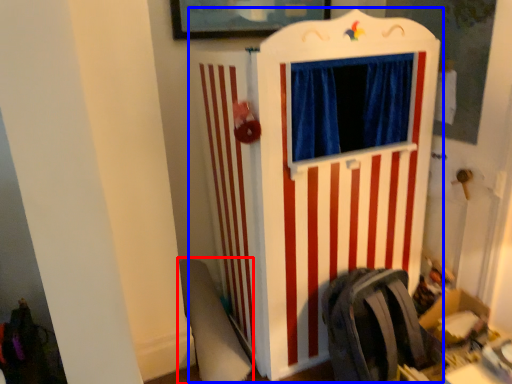
Question: Which object is closer to the camera taking this photo, swivel chair (highlighted by a red box) or furniture (highlighted by a blue box)?

Choices:
 (A) swivel chair
 (B) furniture

Answer: (B)